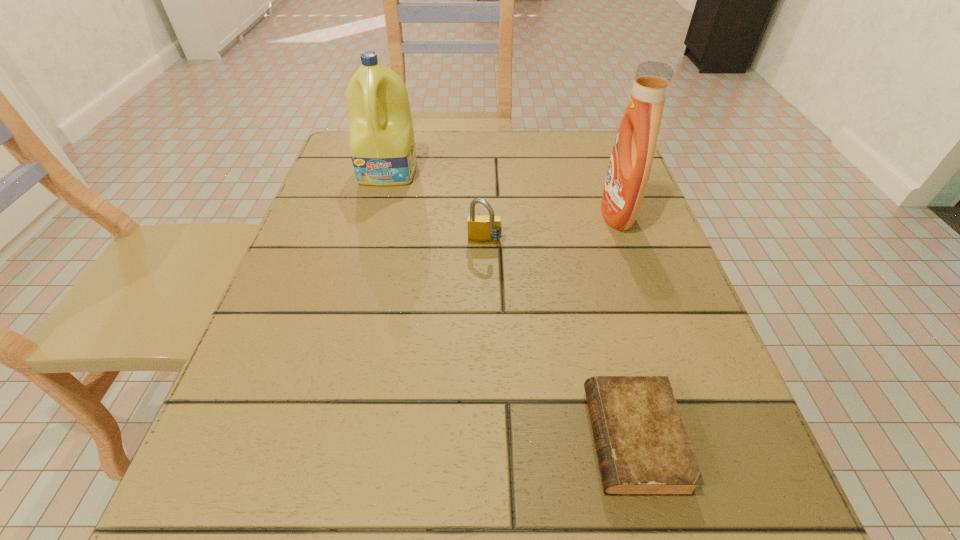
The height and width of the screenshot is (540, 960). Find the location of `free space between the left detergent and the nearer detergent`. free space between the left detergent and the nearer detergent is located at coordinates (503, 192).

Where is `unoccupied area between the farthest object and the nearer detergent`? This screenshot has width=960, height=540. unoccupied area between the farthest object and the nearer detergent is located at coordinates (503, 192).

Locate an element on the screen. The width and height of the screenshot is (960, 540). vacant space that's between the padlock and the nearer detergent is located at coordinates point(551,229).

I want to click on free space between the shortest object and the leftmost object, so pyautogui.click(x=512, y=305).

Locate an element on the screen. free area in between the right detergent and the farther detergent is located at coordinates (503, 192).

I want to click on free point between the second object from left to right and the nearest object, so click(559, 342).

This screenshot has width=960, height=540. I want to click on vacant area between the second shortest object and the farther detergent, so click(437, 207).

Find the location of `vacant area that lies between the shortest object and the left detergent`. vacant area that lies between the shortest object and the left detergent is located at coordinates (512, 305).

Identify the location of vacant region between the nearer detergent and the left detergent. (503, 192).

Where is `object that is the second closest one to the second shortest object`? The height and width of the screenshot is (540, 960). object that is the second closest one to the second shortest object is located at coordinates [629, 169].